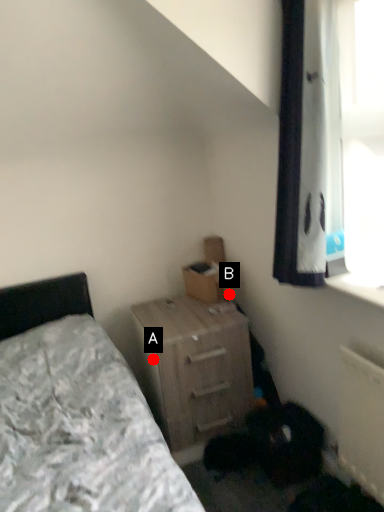
Question: Two points are circled on the image, labeled by A and B beside each circle. Which point is farther to the camera?

Choices:
 (A) A is further
 (B) B is further

Answer: (B)